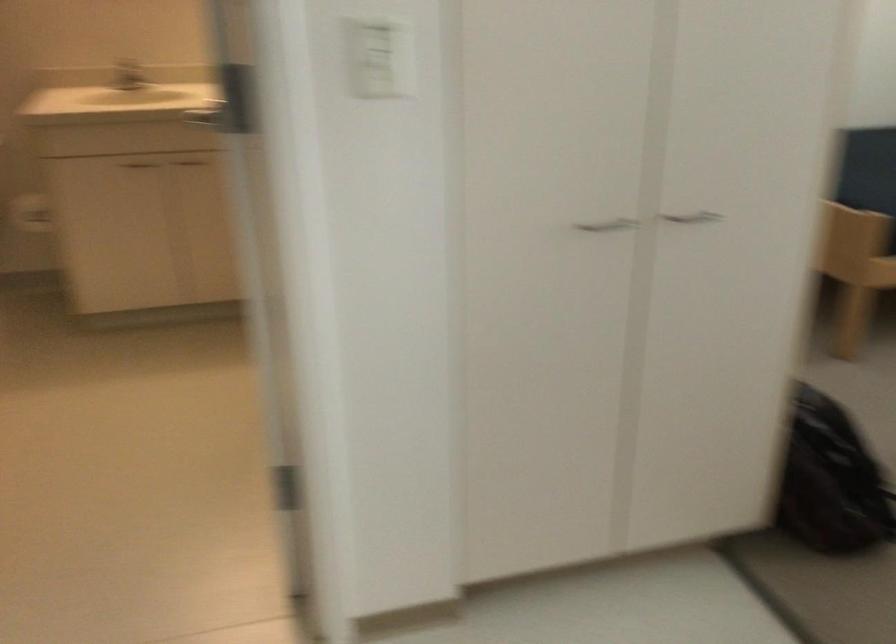
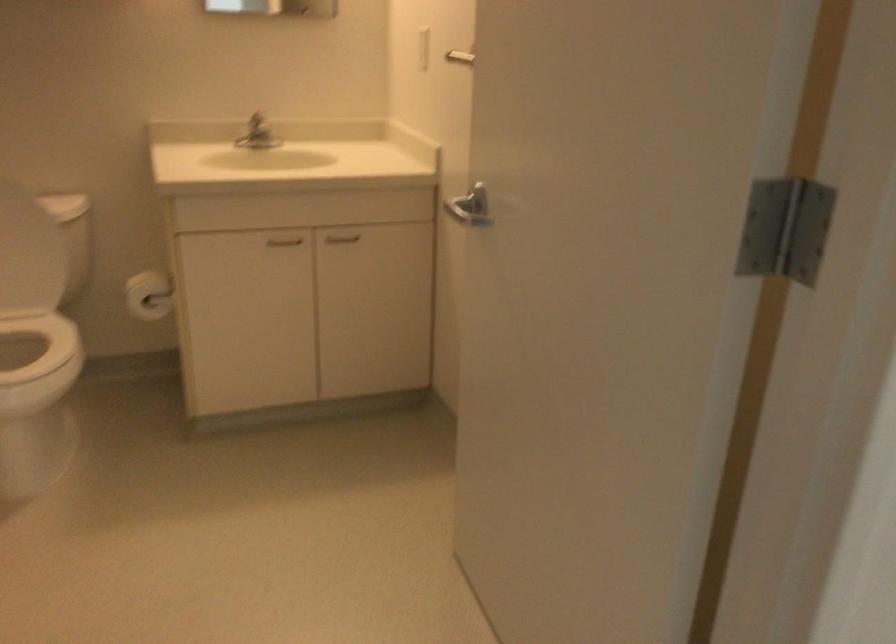
Question: The camera is either moving clockwise (left) or counter-clockwise (right) around the object. The first image is from the beginning of the video and the second image is from the end. Is the camera moving left or right when shooting the video?

Choices:
 (A) Left
 (B) Right

Answer: (A)